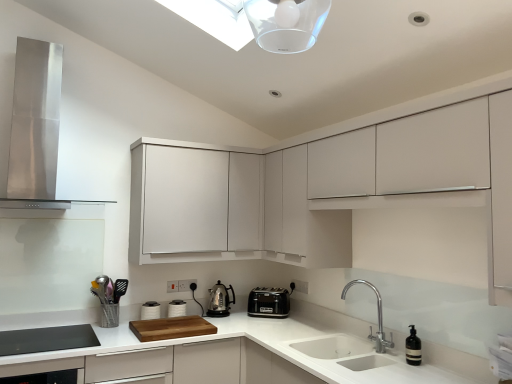
Question: From the image's perspective, relative to stainless steel range hood at upper left, is black plastic toaster at center, marked as the first kitchen appliance in a right-to-left arrangement, above or below?

Choices:
 (A) below
 (B) above

Answer: (A)

Question: Is black plastic toaster at center, marked as the first kitchen appliance in a right-to-left arrangement, spatially inside stainless steel range hood at upper left, or outside of it?

Choices:
 (A) outside
 (B) inside

Answer: (A)

Question: Which object is positioned farthest from the black glass dishwasher at lower left?

Choices:
 (A) polished stainless steel kettle at center, marked as the 1th kitchen appliance in a left-to-right arrangement
 (B) white matte cabinet at upper center, acting as the 1th cabinetry starting from the right
 (C) white glossy sink at lower center
 (D) polished stainless steel faucet at lower right
 (E) white matte cabinet at upper center, acting as the second cabinetry starting from the right

Answer: (D)

Question: Which object is the closest to the white matte cabinet at upper center, acting as the second cabinetry starting from the right?

Choices:
 (A) stainless steel range hood at upper left
 (B) white matte cabinet at upper center, the second cabinetry in the left-to-right sequence
 (C) white glossy sink at lower center
 (D) black glass dishwasher at lower left
 (E) metallic silver utensil holder at lower left

Answer: (B)